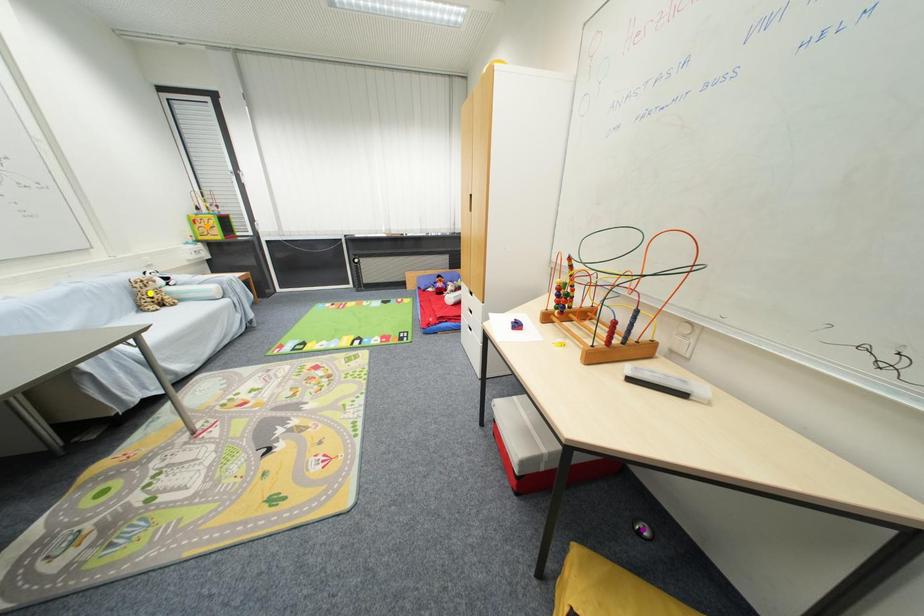
Order these from nearest to farthest:
orange point | purple point | yellow point

purple point < yellow point < orange point